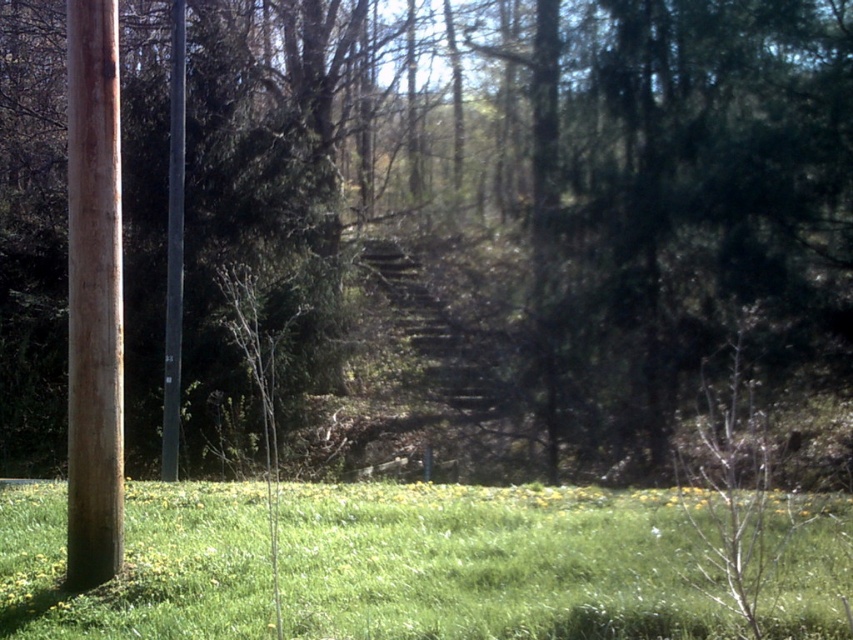
Question: Which point appears closest to the camera in this image?

Choices:
 (A) (170, 136)
 (B) (78, 547)

Answer: (B)

Question: Is brown wood pole at left thinner than black smooth pole at left?

Choices:
 (A) yes
 (B) no

Answer: (B)

Question: Does green grassy at lower center come behind black smooth pole at left?

Choices:
 (A) yes
 (B) no

Answer: (B)

Question: Which object is the closest to the black smooth pole at left?

Choices:
 (A) brown wood pole at left
 (B) green grassy at lower center

Answer: (A)

Question: Is green grassy at lower center to the right of black smooth pole at left from the viewer's perspective?

Choices:
 (A) no
 (B) yes

Answer: (B)

Question: Which of the following is the farthest from the observer?

Choices:
 (A) (80, 152)
 (B) (538, 560)

Answer: (B)